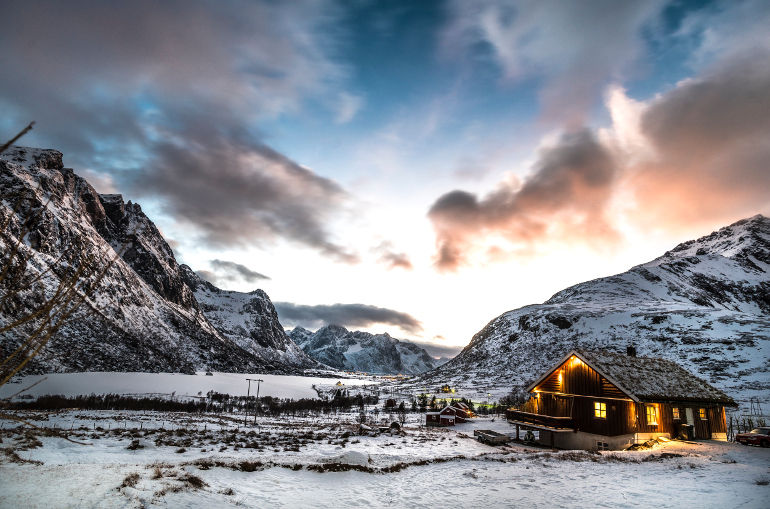
The height and width of the screenshot is (509, 770). I want to click on windows, so click(598, 408), click(650, 414), click(673, 413), click(700, 414).